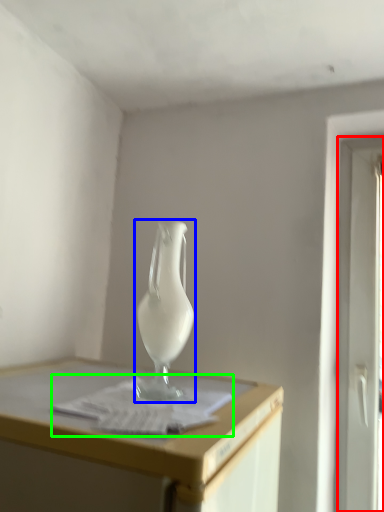
Question: Based on their relative distances, which object is farther from screen door (highlighted by a red box)? Choose from vase (highlighted by a blue box) and paper (highlighted by a green box).

Choices:
 (A) vase
 (B) paper

Answer: (B)